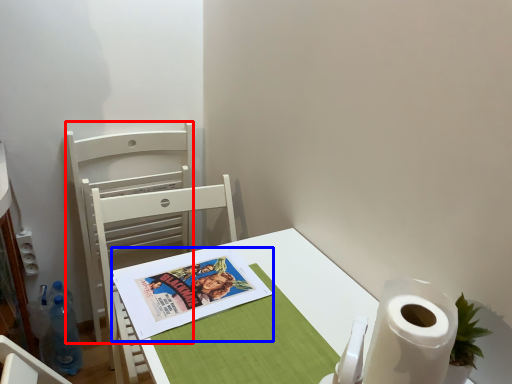
Question: Among these objects, which one is nearest to the camera, chair (highlighted by a red box) or comic book (highlighted by a blue box)?

Choices:
 (A) chair
 (B) comic book

Answer: (B)